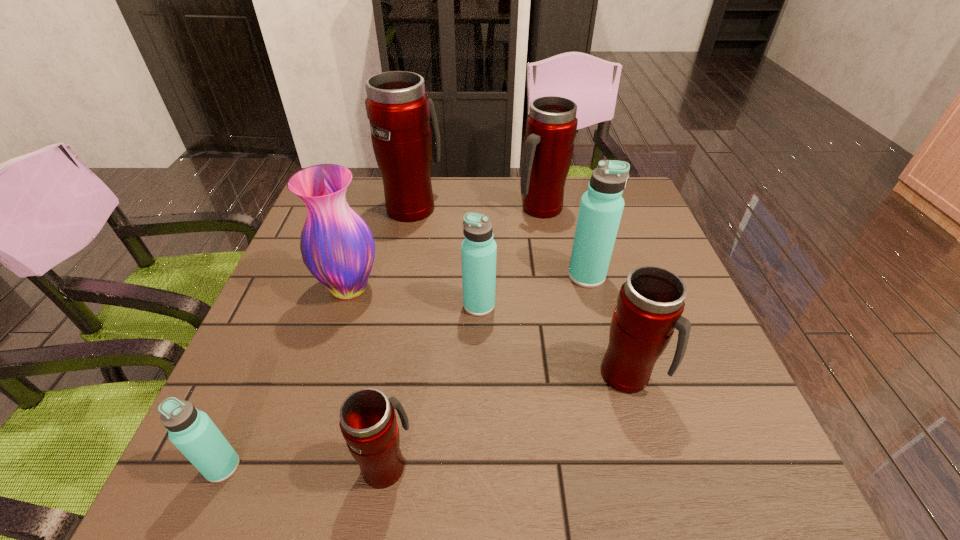
This screenshot has height=540, width=960. Find the location of `the smallest red thermos bottle`. the smallest red thermos bottle is located at coordinates (368, 423).

You are a GUI agent. You are given a task and a screenshot of the screen. Output one action in this format:
    pyautogui.click(x=<x>, y=<y>)
    Task: Click on the leftmost aqua thermos bottle
    
    Given the screenshot: What is the action you would take?
    (192, 431)

Where is `the leftmost object`? This screenshot has width=960, height=540. the leftmost object is located at coordinates (192, 431).

Find the location of a particular element. vacant space positioned on the side with the handle of the tallest object is located at coordinates (420, 177).

The height and width of the screenshot is (540, 960). Identify the location of free space located on the front of the third farthest thermos bottle. (602, 335).

At what (x,y) coordinates should I click in order to perform the action: click on vacant region located on the side with the handle of the second biggest red thermos bottle. Please return your answer as a coordinate pair (x, y). This screenshot has height=540, width=960. Looking at the image, I should click on (558, 306).

Image resolution: width=960 pixels, height=540 pixels. In order to click on free point located 0.310m on the right of the purple vase in this screenshot , I will do `click(516, 288)`.

At what (x,y) coordinates should I click in order to perform the action: click on free space located on the front of the second smallest aqua thermos bottle. Please return your answer as a coordinate pair (x, y). This screenshot has width=960, height=540. Looking at the image, I should click on (479, 366).

Image resolution: width=960 pixels, height=540 pixels. I want to click on blank area located on the side with the handle of the third nearest thermos bottle, so click(x=689, y=375).

You are a GUI agent. You are given a task and a screenshot of the screen. Output one action in this format:
    pyautogui.click(x=<x>, y=<y>)
    Task: Click on the free space located 0.240m on the side with the handle of the nearest red thermos bottle
    Image resolution: width=960 pixels, height=540 pixels.
    Given the screenshot: What is the action you would take?
    pyautogui.click(x=407, y=332)